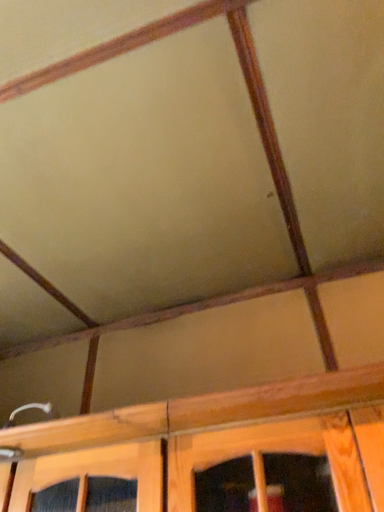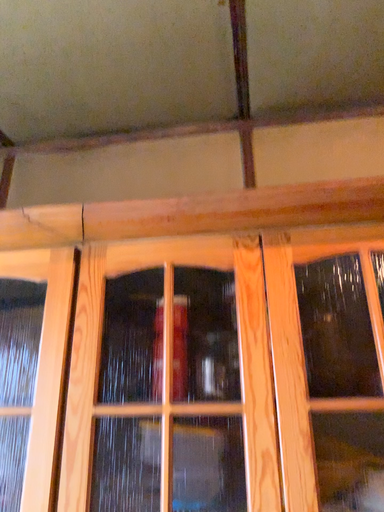
Question: How did the camera likely rotate when shooting the video?

Choices:
 (A) rotated upward
 (B) rotated downward

Answer: (B)